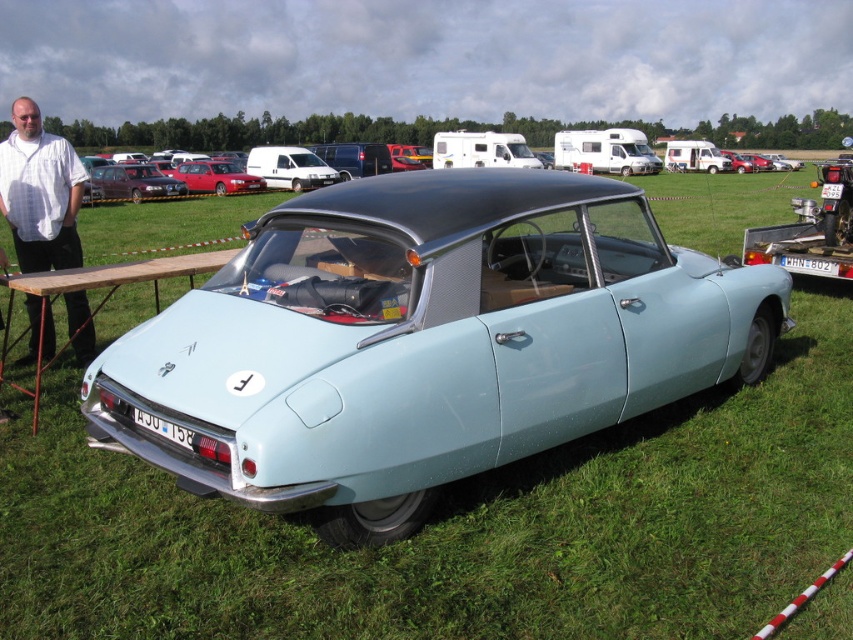
Is light blue matte car at center below white shirt at left?

Yes, light blue matte car at center is below white shirt at left.

Between light blue matte car at center and white shirt at left, which one appears on the left side from the viewer's perspective?

white shirt at left

Does point (102, 436) lie behind point (74, 321)?

No, it is in front of (74, 321).

This screenshot has height=640, width=853. Find the location of `light blue matte car at center`. light blue matte car at center is located at coordinates (424, 342).

What do you see at coordinates (113, 276) in the screenshot?
I see `wooden picnic table at center` at bounding box center [113, 276].

Does wooden picnic table at center have a larger size compared to metallic red car at center?

No, wooden picnic table at center is not bigger than metallic red car at center.

The image size is (853, 640). Find the location of `wooden picnic table at center`. wooden picnic table at center is located at coordinates (113, 276).

Which is behind, point (33, 198) or point (41, 301)?

The point (41, 301) is more distant.

Image resolution: width=853 pixels, height=640 pixels. I want to click on white shirt at left, so click(x=39, y=193).

Measure the distance between point (21,202) and camera.

Point (21,202) is 17.60 feet from camera.

The width and height of the screenshot is (853, 640). In order to click on white shirt at left in this screenshot , I will do `click(39, 193)`.